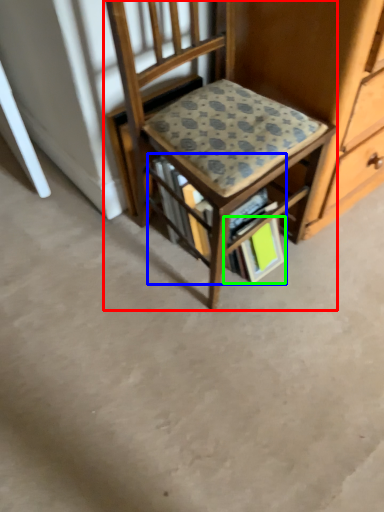
Question: Which object is positioned farthest from chair (highlighted by a red box)? Select from book (highlighted by a blue box) and paperback book (highlighted by a green box).

Choices:
 (A) book
 (B) paperback book

Answer: (B)